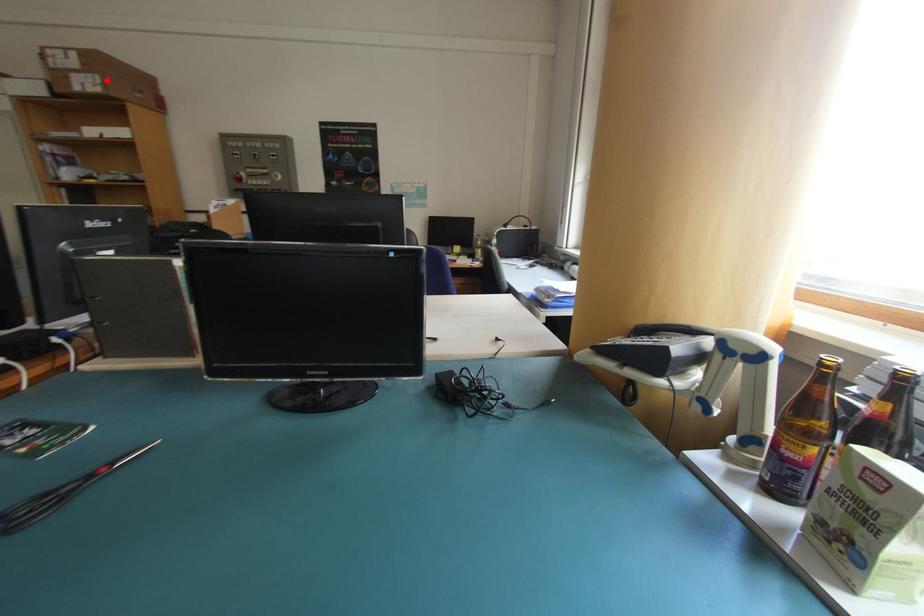
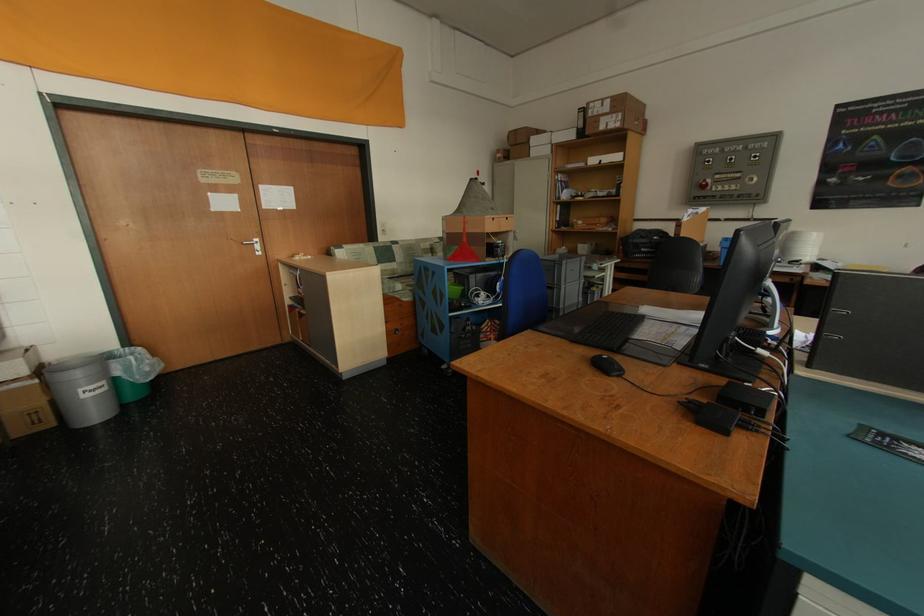
Locate, in the second image, the point that corresponds to the highlighted location in the first image.

(628, 118)